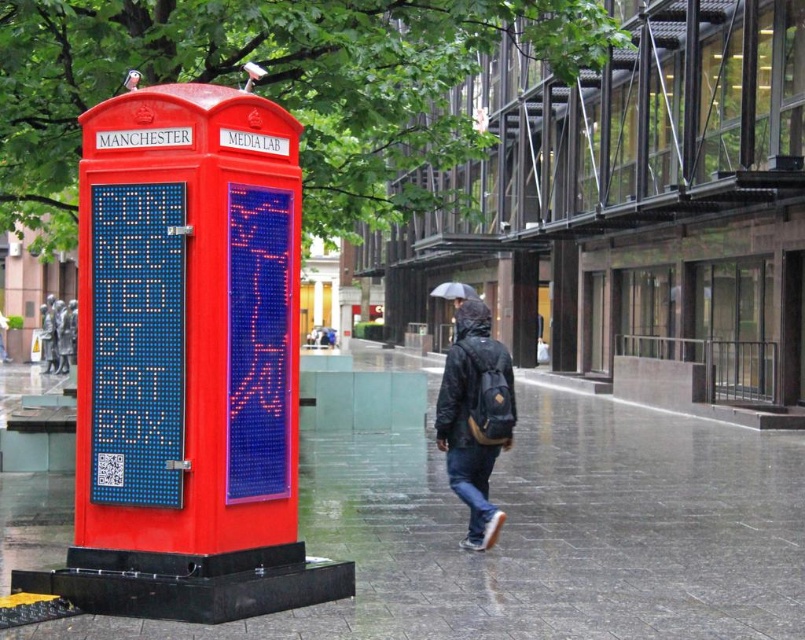
Question: Which of these objects is positioned closest to the glossy concrete pavement at lower center?

Choices:
 (A) dark blue backpack at center
 (B) black matte umbrella at upper center

Answer: (B)

Question: Is glossy concrete pavement at lower center above black matte umbrella at upper center?

Choices:
 (A) no
 (B) yes

Answer: (A)

Question: Does dark blue backpack at center appear on the right side of black matte umbrella at upper center?

Choices:
 (A) yes
 (B) no

Answer: (B)

Question: Which point is closer to the camera?

Choices:
 (A) black matte umbrella at upper center
 (B) dark blue backpack at center
 (C) glossy concrete pavement at lower center

Answer: (C)

Question: Is glossy concrete pavement at lower center to the right of dark blue backpack at center from the viewer's perspective?

Choices:
 (A) yes
 (B) no

Answer: (A)

Question: Which point is closer to the camera taking this photo?

Choices:
 (A) (471, 298)
 (B) (465, 573)

Answer: (B)